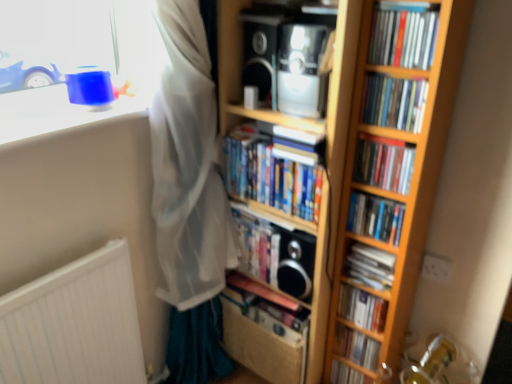
Image resolution: width=512 pixels, height=384 pixels. I want to click on hardcover books at center, the eighth book when ordered from bottom to top, so click(x=383, y=163).

Describe the element at coordinates (74, 324) in the screenshot. I see `white matte radiator at lower left` at that location.

The height and width of the screenshot is (384, 512). What are the coordinates of `wooden bookcase at center` in the screenshot? It's located at (385, 189).

Find the location of a particular element. hardcover book at center, the 5th book in the top-to-bottom sequence is located at coordinates point(376,217).

How much space does metallic silver speaker at upper center, the second speaker in the bottom-to-top sequence, occupy vertically?

9.17 inches.

Image resolution: width=512 pixels, height=384 pixels. What do you see at coordinates (54, 112) in the screenshot? I see `blue plastic toy at upper left` at bounding box center [54, 112].

I want to click on hardcover books at center, the eighth book when ordered from bottom to top, so click(x=383, y=163).

Is point (380, 221) positioned in front of point (234, 170)?

Yes, it is in front of point (234, 170).

Can you confirm if hardcover book at center, the 5th book in the top-to-bottom sequence, is bigger than hardcover books at center, the 4th book when ordered from top to bottom?

Incorrect, hardcover book at center, the 5th book in the top-to-bottom sequence, is not larger than hardcover books at center, the 4th book when ordered from top to bottom.

Can you confirm if black matte speaker at center, the third speaker positioned from the top, is thinner than hardcover book at center, which ranks as the 6th book in bottom-to-top order?

Yes.

From the image's perspective, would you say black matte speaker at center, the third speaker positioned from the top, is shown under hardcover book at center, which ranks as the 6th book in bottom-to-top order?

Correct, black matte speaker at center, the third speaker positioned from the top, appears lower than hardcover book at center, which ranks as the 6th book in bottom-to-top order, in the image.

Does black matte speaker at center, the third speaker positioned from the top, turn towards hardcover book at center, the 5th book in the top-to-bottom sequence?

No, black matte speaker at center, the third speaker positioned from the top, is not turned towards hardcover book at center, the 5th book in the top-to-bottom sequence.

Between black matte speaker at center, the third speaker positioned from the top, and hardcover book at center, which ranks as the 6th book in bottom-to-top order, which one has smaller size?

hardcover book at center, which ranks as the 6th book in bottom-to-top order.

How different are the orientations of matte plastic books at upper right, the tenth book from the bottom, and matte black book at right, the 7th book when ordered from top to bottom, in degrees?

0.203 degrees.

Considering their positions, is matte plastic books at upper right, acting as the 1th book starting from the top, located in front of or behind matte black book at right, marked as the 4th book in a bottom-to-top arrangement?

Clearly, matte plastic books at upper right, acting as the 1th book starting from the top, is in front of matte black book at right, marked as the 4th book in a bottom-to-top arrangement.

Measure the distance between matte plastic books at upper right, the tenth book from the bottom, and matte black book at right, the 7th book when ordered from top to bottom.

They are 23.23 inches apart.

Between matte plastic books at upper right, acting as the 1th book starting from the top, and matte black book at right, marked as the 4th book in a bottom-to-top arrangement, which one has larger width?

matte black book at right, marked as the 4th book in a bottom-to-top arrangement, is wider.

Does point (365, 95) lie in front of point (381, 31)?

That is False.

From a real-world perspective, between hardcover books at upper right, which is the second book from top to bottom, and matte plastic books at upper right, the tenth book from the bottom, who is vertically lower?

hardcover books at upper right, which is the second book from top to bottom.

Considering the relative sizes of hardcover books at upper right, which is the second book from top to bottom, and matte plastic books at upper right, the tenth book from the bottom, in the image provided, is hardcover books at upper right, which is the second book from top to bottom, shorter than matte plastic books at upper right, the tenth book from the bottom,?

No, hardcover books at upper right, which is the second book from top to bottom, is not shorter than matte plastic books at upper right, the tenth book from the bottom.

Does white matte radiator at lower left have a smaller size compared to hardcover book at center, placed as the 5th book when sorted from bottom to top?

No.

How different are the orientations of white matte radiator at lower left and hardcover book at center, the sixth book viewed from the top, in degrees?

The angular difference between white matte radiator at lower left and hardcover book at center, the sixth book viewed from the top, is 89.4 degrees.

Is hardcover book at center, placed as the 5th book when sorted from bottom to top, a part of white matte radiator at lower left?

No, hardcover book at center, placed as the 5th book when sorted from bottom to top, is located outside of white matte radiator at lower left.

Is hardcover books at center, placed as the 7th book when sorted from bottom to top, touching white matte radiator at lower left?

No.

From the image's perspective, does hardcover books at center, placed as the 7th book when sorted from bottom to top, appear higher than white matte radiator at lower left?

Yes.

Is hardcover books at center, placed as the 7th book when sorted from bottom to top, bigger or smaller than white matte radiator at lower left?

Clearly, hardcover books at center, placed as the 7th book when sorted from bottom to top, is larger in size than white matte radiator at lower left.

Is hardcover books at center, the 4th book when ordered from top to bottom, further to camera compared to matte black book at right, the 7th book when ordered from top to bottom?

No, hardcover books at center, the 4th book when ordered from top to bottom, is closer to the viewer.

Is hardcover books at center, placed as the 7th book when sorted from bottom to top, far away from matte black book at right, the 7th book when ordered from top to bottom?

Actually, hardcover books at center, placed as the 7th book when sorted from bottom to top, and matte black book at right, the 7th book when ordered from top to bottom, are a little close together.

Based on the photo, between hardcover books at center, the 4th book when ordered from top to bottom, and matte black book at right, the 7th book when ordered from top to bottom, which one appears on the right side from the viewer's perspective?

From the viewer's perspective, matte black book at right, the 7th book when ordered from top to bottom, appears more on the right side.

Find the location of a particular element. the 2nd book in front of the matte black book at right, marked as the 4th book in a bottom-to-top arrangement, counting from the anchor's position is located at coordinates (271, 172).

The width and height of the screenshot is (512, 384). Identify the location of the 7th book to the right of the hardcover books at center, the 4th book when ordered from top to bottom, counting from the anchor's position. (376, 217).

This screenshot has height=384, width=512. Identify the location of speaker below the hardcover book at center, the 5th book in the top-to-bottom sequence (from the image's perspective). (296, 263).

Based on their spatial positions, is hardcover book at center, the second book ordered from the bottom, or matte black book at right, the 7th book when ordered from top to bottom, further from hardcover books at center, placed as the 7th book when sorted from bottom to top?

hardcover book at center, the second book ordered from the bottom, is further to hardcover books at center, placed as the 7th book when sorted from bottom to top.

Looking at this image, when comparing their distances from hardcover books at center, placed as the 7th book when sorted from bottom to top, does hardcover books at center, which is the 3th book in top-to-bottom order, or satin black speaker at upper center, the 1th speaker positioned from the top, seem closer?

satin black speaker at upper center, the 1th speaker positioned from the top, lies closer to hardcover books at center, placed as the 7th book when sorted from bottom to top, than the other object.

From the picture: Considering their positions, is hardcover books at center, the 4th book when ordered from top to bottom, positioned further to matte black book at right, marked as the 4th book in a bottom-to-top arrangement, than matte plastic books at upper right, acting as the 1th book starting from the top?

matte plastic books at upper right, acting as the 1th book starting from the top, is further to matte black book at right, marked as the 4th book in a bottom-to-top arrangement.

Which object lies nearer to the anchor point hardcover books at center, the eighth book when ordered from bottom to top, matte black book at center, the 1th book positioned from the bottom, or hardcover book at center, the 5th book in the top-to-bottom sequence?

Based on the image, hardcover book at center, the 5th book in the top-to-bottom sequence, appears to be nearer to hardcover books at center, the eighth book when ordered from bottom to top.

Estimate the real-world distances between objects in this image. Which object is closer to black matte speaker at center, the third speaker positioned from the top, hardcover books at upper right, the ninth book positioned from the bottom, or hardcover book at center, the 5th book in the top-to-bottom sequence?

hardcover book at center, the 5th book in the top-to-bottom sequence, lies closer to black matte speaker at center, the third speaker positioned from the top, than the other object.

From the picture: Which object lies further to the anchor point hardcover book at center, the third book ordered from the bottom, matte black book at center, the tenth book in the top-to-bottom sequence, or hardcover book at center, the 5th book in the top-to-bottom sequence?

hardcover book at center, the 5th book in the top-to-bottom sequence, is further to hardcover book at center, the third book ordered from the bottom.

Which object lies nearer to the anchor point matte black book at right, marked as the 4th book in a bottom-to-top arrangement, hardcover book at center, which is counted as the ninth book, starting from the top, or satin black speaker at upper center, the 1th speaker positioned from the top?

The object closer to matte black book at right, marked as the 4th book in a bottom-to-top arrangement, is hardcover book at center, which is counted as the ninth book, starting from the top.

Which object lies nearer to the anchor point matte black book at center, the 1th book positioned from the bottom, hardcover books at center, the eighth book when ordered from bottom to top, or black matte speaker at center, marked as the first speaker in a bottom-to-top arrangement?

black matte speaker at center, marked as the first speaker in a bottom-to-top arrangement, is positioned closer to the anchor matte black book at center, the 1th book positioned from the bottom.

The height and width of the screenshot is (384, 512). I want to click on radiator that lies between satin black speaker at upper center, the 1th speaker positioned from the top, and hardcover book at center, which is counted as the ninth book, starting from the top, from top to bottom, so click(74, 324).

Find the location of a particular element. window sill between metallic silver speaker at upper center, the second speaker in the bottom-to-top sequence, and white matte radiator at lower left in the up-down direction is located at coordinates (54, 112).

This screenshot has height=384, width=512. Identify the location of speaker between satin black speaker at upper center, the 3th speaker when ordered from bottom to top, and black matte speaker at center, marked as the first speaker in a bottom-to-top arrangement, vertically. (302, 70).

The image size is (512, 384). Identify the location of bookcase between satin black speaker at upper center, the 1th speaker positioned from the top, and matte black book at center, the tenth book in the top-to-bottom sequence, vertically. (385, 189).